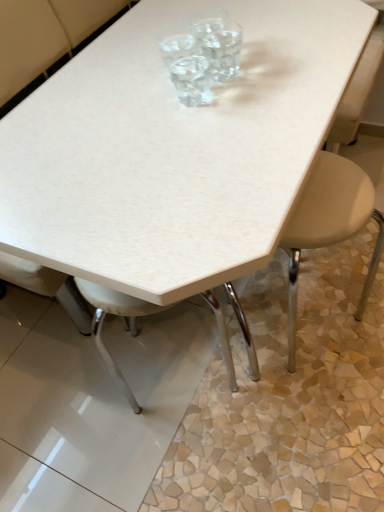
Where is `vacant space behind beige plastic chair at lower right`? vacant space behind beige plastic chair at lower right is located at coordinates (302, 282).